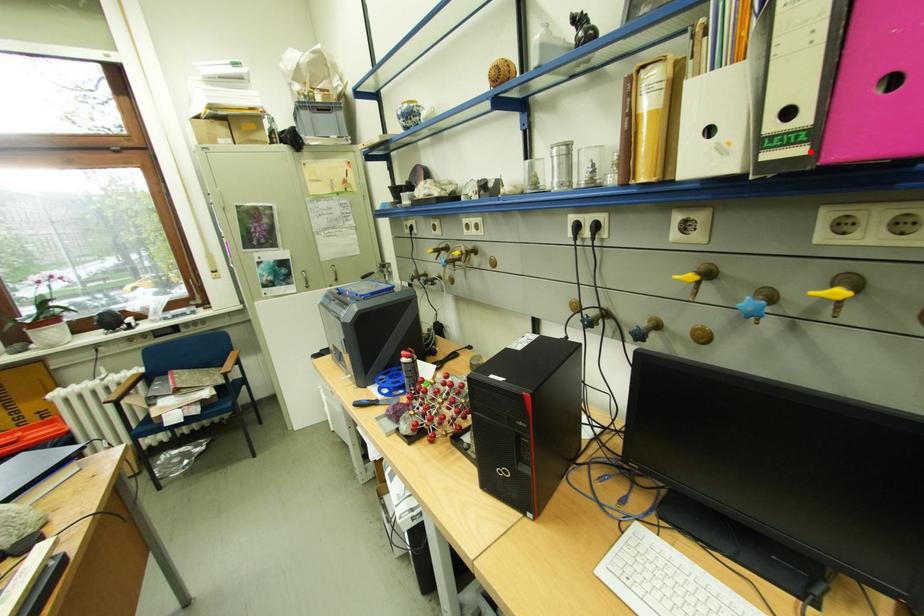
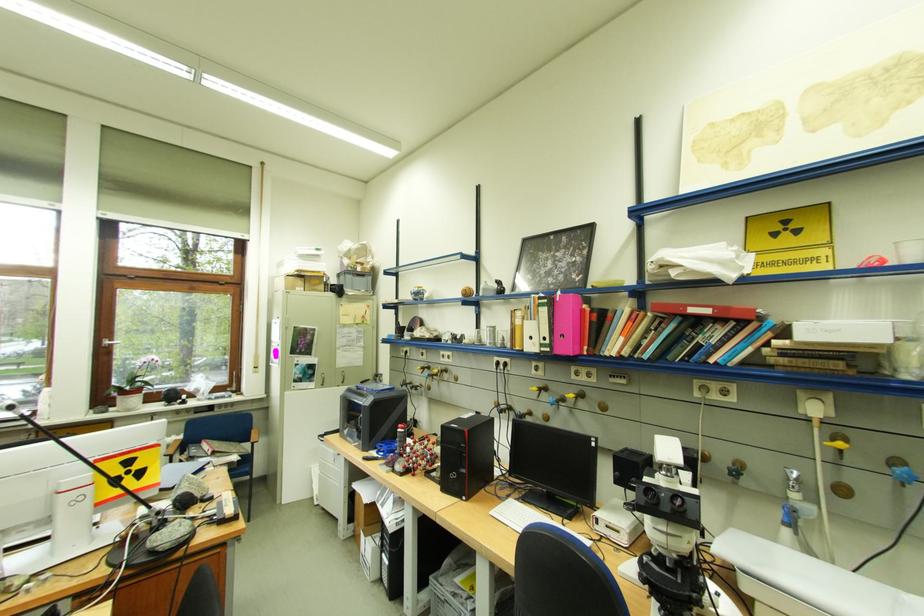
Find the pixel in the second image that matches the highlighted location in the first image.

(558, 351)